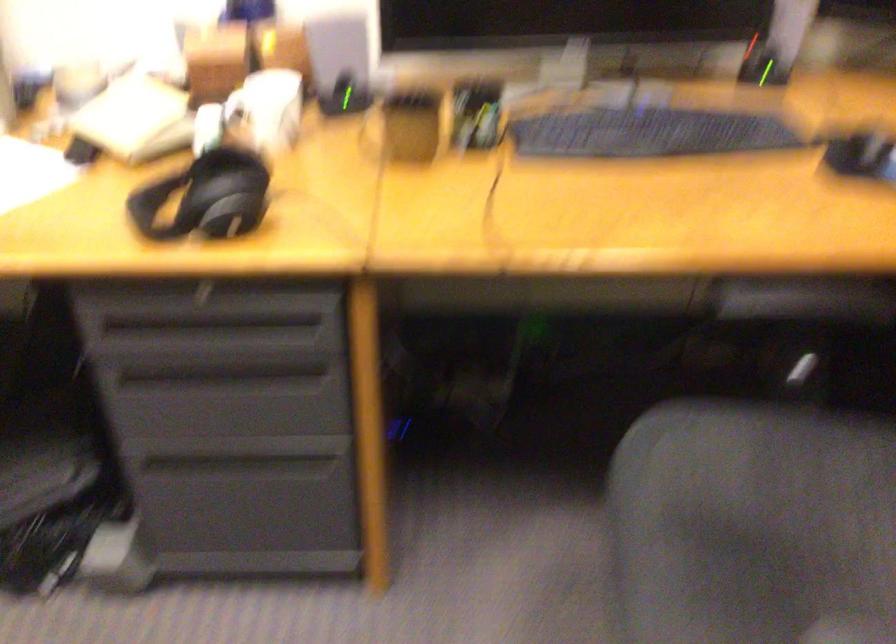
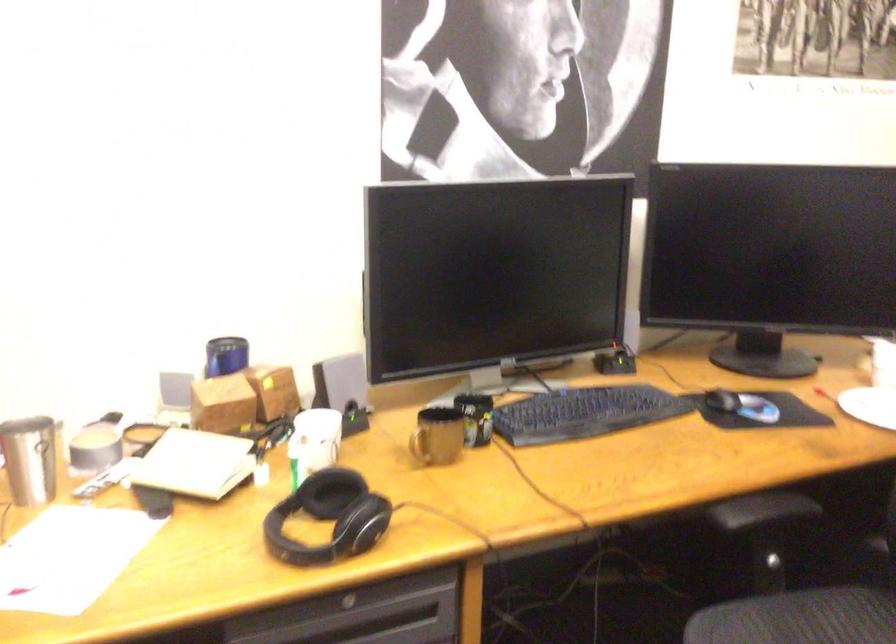
The point at (x=814, y=442) is marked in the first image. Where is the corresponding point in the second image?

(805, 612)